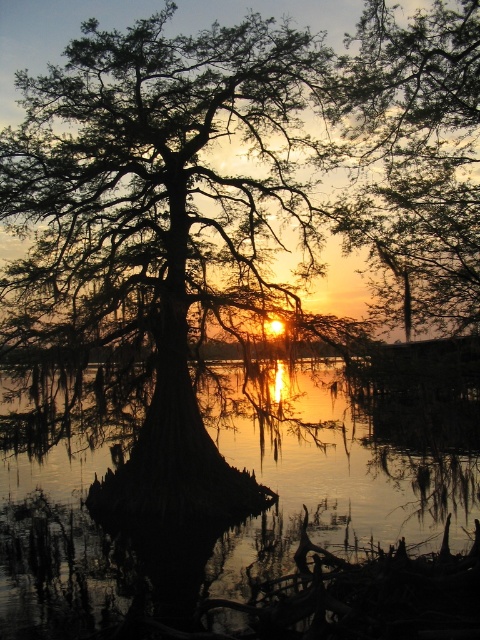
In the scene shown: You are an artist planning to paint this sunset scene. You have two brushes, one for the silhouette wood cypress tree at center and another for the smooth bark tree at upper center. If you want to use the larger brush for the wider object, which tree should you choose the larger brush for?

The silhouette wood cypress tree at center has a larger width than the smooth bark tree at upper center, so you should choose the larger brush for the silhouette wood cypress tree at center.

You are an observer standing at the edge of the water. Looking at the glossy reflective water at center and the smooth bark tree at upper center, which object is closer to your viewpoint?

The glossy reflective water at center is closer to your viewpoint because it is positioned below the smooth bark tree at upper center, placing it lower in the visual field.

You are a photographer trying to capture the sunset reflection on the water. You notice the silhouette wood cypress tree at center and the glossy reflective water at center. Which object is closer to you, and how does this affect the reflection in your photo?

The silhouette wood cypress tree at center is closer to you than the glossy reflective water at center. Since the glossy reflective water at center is behind the tree, the reflection of the sunset on the water might be partially obscured by the tree in the foreground, creating a layered effect in your photo.